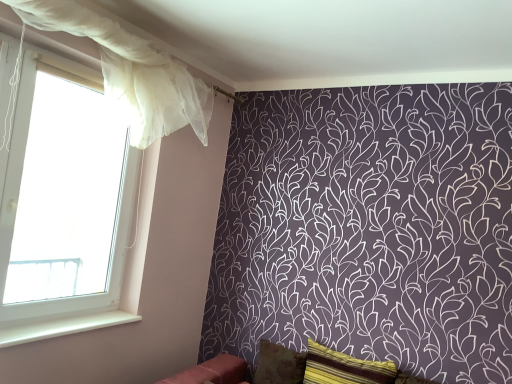
I want to click on striped fabric pillow at lower right, marked as the first pillow in a front-to-back arrangement, so click(x=344, y=368).

At what (x,y) coordinates should I click in order to perform the action: click on white smooth window sill at lower left. Please return your answer as a coordinate pair (x, y). This screenshot has width=512, height=384. Looking at the image, I should click on (64, 327).

Where is `velvet red sofa at lower center`? velvet red sofa at lower center is located at coordinates (213, 372).

Describe the element at coordinates (67, 194) in the screenshot. The image size is (512, 384). I see `white sheer curtain at left` at that location.

The height and width of the screenshot is (384, 512). Describe the element at coordinates (279, 365) in the screenshot. I see `brown textured pillow at lower center, which is the 2th pillow from front to back` at that location.

You are a GUI agent. You are given a task and a screenshot of the screen. Output one action in this format:
    pyautogui.click(x=<x>, y=<y>)
    Task: Click on the striped fabric pillow at lower right, placed as the second pillow when sorted from back to front
    
    Given the screenshot: What is the action you would take?
    pyautogui.click(x=344, y=368)

Which object is closer to the camera taking this photo, white smooth window sill at lower left or striped fabric pillow at lower right, placed as the second pillow when sorted from back to front?

white smooth window sill at lower left is more forward.

Is white smooth window sill at lower left wider than striped fabric pillow at lower right, marked as the first pillow in a front-to-back arrangement?

No.

Which is more to the right, white smooth window sill at lower left or striped fabric pillow at lower right, marked as the first pillow in a front-to-back arrangement?

Positioned to the right is striped fabric pillow at lower right, marked as the first pillow in a front-to-back arrangement.

From the picture: What's the angular difference between white smooth window sill at lower left and striped fabric pillow at lower right, placed as the second pillow when sorted from back to front,'s facing directions?

They differ by 90.1 degrees in their facing directions.

Which of these two, brown textured pillow at lower center, which is the 2th pillow from front to back, or white smooth window sill at lower left, stands shorter?

With less height is white smooth window sill at lower left.

Which object is wider, brown textured pillow at lower center, the first pillow viewed from the back, or white smooth window sill at lower left?

white smooth window sill at lower left is wider.

Is velvet red sofa at lower center at the left side of white smooth window sill at lower left?

Incorrect, velvet red sofa at lower center is not on the left side of white smooth window sill at lower left.

Is velvet red sofa at lower center with white smooth window sill at lower left?

No.

In terms of height, does velvet red sofa at lower center look taller or shorter compared to white smooth window sill at lower left?

Considering their sizes, velvet red sofa at lower center has more height than white smooth window sill at lower left.

Is velvet red sofa at lower center positioned in front of white smooth window sill at lower left?

Yes, the depth of velvet red sofa at lower center is less than that of white smooth window sill at lower left.

Is white smooth window sill at lower left not inside translucent white curtain at left?

Yes, white smooth window sill at lower left is not within translucent white curtain at left.

Which object is positioned more to the right, white smooth window sill at lower left or translucent white curtain at left?

Positioned to the right is translucent white curtain at left.

Does white smooth window sill at lower left touch translucent white curtain at left?

No, white smooth window sill at lower left is not next to translucent white curtain at left.

From their relative heights in the image, would you say white smooth window sill at lower left is taller or shorter than translucent white curtain at left?

white smooth window sill at lower left is shorter than translucent white curtain at left.

Which of these two, velvet red sofa at lower center or brown textured pillow at lower center, the first pillow viewed from the back, stands shorter?

Standing shorter between the two is velvet red sofa at lower center.

Does velvet red sofa at lower center appear on the left side of brown textured pillow at lower center, which is the 2th pillow from front to back?

Yes, velvet red sofa at lower center is to the left of brown textured pillow at lower center, which is the 2th pillow from front to back.

Is point (212, 381) closer or farther from the camera than point (290, 372)?

Point (212, 381).

From a real-world perspective, between velvet red sofa at lower center and brown textured pillow at lower center, which is the 2th pillow from front to back, who is vertically lower?

velvet red sofa at lower center, from a real-world perspective.

Where is `furniture above the striped fabric pillow at lower right, marked as the first pillow in a front-to-back arrangement (from the image's perspective)`? This screenshot has width=512, height=384. furniture above the striped fabric pillow at lower right, marked as the first pillow in a front-to-back arrangement (from the image's perspective) is located at coordinates (213, 372).

From the image's perspective, which one is positioned lower, velvet red sofa at lower center or striped fabric pillow at lower right, placed as the second pillow when sorted from back to front?

From the image's view, striped fabric pillow at lower right, placed as the second pillow when sorted from back to front, is below.

From the picture: Is velvet red sofa at lower center wider or thinner than striped fabric pillow at lower right, marked as the first pillow in a front-to-back arrangement?

In the image, velvet red sofa at lower center appears to be wider than striped fabric pillow at lower right, marked as the first pillow in a front-to-back arrangement.

Is striped fabric pillow at lower right, placed as the second pillow when sorted from back to front, at the back of velvet red sofa at lower center?

velvet red sofa at lower center does not have its back to striped fabric pillow at lower right, placed as the second pillow when sorted from back to front.

From the image's perspective, relative to striped fabric pillow at lower right, marked as the first pillow in a front-to-back arrangement, is brown textured pillow at lower center, the first pillow viewed from the back, above or below?

brown textured pillow at lower center, the first pillow viewed from the back, is situated lower than striped fabric pillow at lower right, marked as the first pillow in a front-to-back arrangement, in the image.

Between brown textured pillow at lower center, the first pillow viewed from the back, and striped fabric pillow at lower right, marked as the first pillow in a front-to-back arrangement, which one has smaller width?

brown textured pillow at lower center, the first pillow viewed from the back, is thinner.

Considering the positions of objects brown textured pillow at lower center, the first pillow viewed from the back, and striped fabric pillow at lower right, placed as the second pillow when sorted from back to front, in the image provided, who is more to the left, brown textured pillow at lower center, the first pillow viewed from the back, or striped fabric pillow at lower right, placed as the second pillow when sorted from back to front,?

From the viewer's perspective, brown textured pillow at lower center, the first pillow viewed from the back, appears more on the left side.

Does brown textured pillow at lower center, which is the 2th pillow from front to back, have a larger size compared to striped fabric pillow at lower right, marked as the first pillow in a front-to-back arrangement?

Actually, brown textured pillow at lower center, which is the 2th pillow from front to back, might be smaller than striped fabric pillow at lower right, marked as the first pillow in a front-to-back arrangement.

The image size is (512, 384). I want to click on window sill that appears in front of the striped fabric pillow at lower right, placed as the second pillow when sorted from back to front, so click(x=64, y=327).

In order to click on the 2nd pillow directly beneath the white smooth window sill at lower left (from a real-world perspective) in this screenshot , I will do `click(279, 365)`.

From the image, which object appears to be nearer to brown textured pillow at lower center, which is the 2th pillow from front to back, striped fabric pillow at lower right, placed as the second pillow when sorted from back to front, or white sheer curtain at left?

striped fabric pillow at lower right, placed as the second pillow when sorted from back to front.

Estimate the real-world distances between objects in this image. Which object is closer to brown textured pillow at lower center, the first pillow viewed from the back, translucent white curtain at left or striped fabric pillow at lower right, marked as the first pillow in a front-to-back arrangement?

Based on the image, striped fabric pillow at lower right, marked as the first pillow in a front-to-back arrangement, appears to be nearer to brown textured pillow at lower center, the first pillow viewed from the back.

From the image, which object appears to be farther from velvet red sofa at lower center, striped fabric pillow at lower right, marked as the first pillow in a front-to-back arrangement, or brown textured pillow at lower center, which is the 2th pillow from front to back?

striped fabric pillow at lower right, marked as the first pillow in a front-to-back arrangement, lies further to velvet red sofa at lower center than the other object.

Considering their positions, is brown textured pillow at lower center, which is the 2th pillow from front to back, positioned closer to white smooth window sill at lower left than translucent white curtain at left?

brown textured pillow at lower center, which is the 2th pillow from front to back.

Which object lies nearer to the anchor point white sheer curtain at left, white smooth window sill at lower left or brown textured pillow at lower center, the first pillow viewed from the back?

white smooth window sill at lower left is closer to white sheer curtain at left.

When comparing their distances from brown textured pillow at lower center, which is the 2th pillow from front to back, does striped fabric pillow at lower right, placed as the second pillow when sorted from back to front, or white smooth window sill at lower left seem closer?

striped fabric pillow at lower right, placed as the second pillow when sorted from back to front, is positioned closer to the anchor brown textured pillow at lower center, which is the 2th pillow from front to back.

When comparing their distances from translucent white curtain at left, does brown textured pillow at lower center, which is the 2th pillow from front to back, or white smooth window sill at lower left seem further?

Among the two, brown textured pillow at lower center, which is the 2th pillow from front to back, is located further to translucent white curtain at left.

Estimate the real-world distances between objects in this image. Which object is closer to brown textured pillow at lower center, which is the 2th pillow from front to back, white smooth window sill at lower left or translucent white curtain at left?

Among the two, white smooth window sill at lower left is located nearer to brown textured pillow at lower center, which is the 2th pillow from front to back.

At what (x,y) coordinates should I click in order to perform the action: click on window screen between translucent white curtain at left and brown textured pillow at lower center, the first pillow viewed from the back, in the up-down direction. Please return your answer as a coordinate pair (x, y). This screenshot has width=512, height=384. Looking at the image, I should click on (67, 194).

I want to click on window sill between translucent white curtain at left and brown textured pillow at lower center, which is the 2th pillow from front to back, from top to bottom, so click(64, 327).

Where is `furniture between white sheer curtain at left and striped fabric pillow at lower right, placed as the second pillow when sorted from back to front, in the horizontal direction`? furniture between white sheer curtain at left and striped fabric pillow at lower right, placed as the second pillow when sorted from back to front, in the horizontal direction is located at coordinates (213, 372).

Locate an element on the screen. The width and height of the screenshot is (512, 384). pillow located between white smooth window sill at lower left and striped fabric pillow at lower right, marked as the first pillow in a front-to-back arrangement, in the left-right direction is located at coordinates (279, 365).